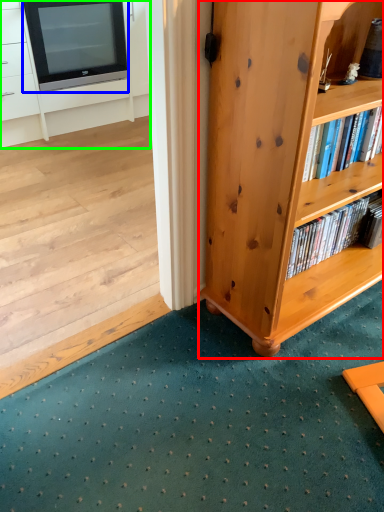
Question: Which object is the farthest from bookcase (highlighted by a red box)? Choose among these: television (highlighted by a blue box) or cabinetry (highlighted by a green box).

Choices:
 (A) television
 (B) cabinetry

Answer: (A)